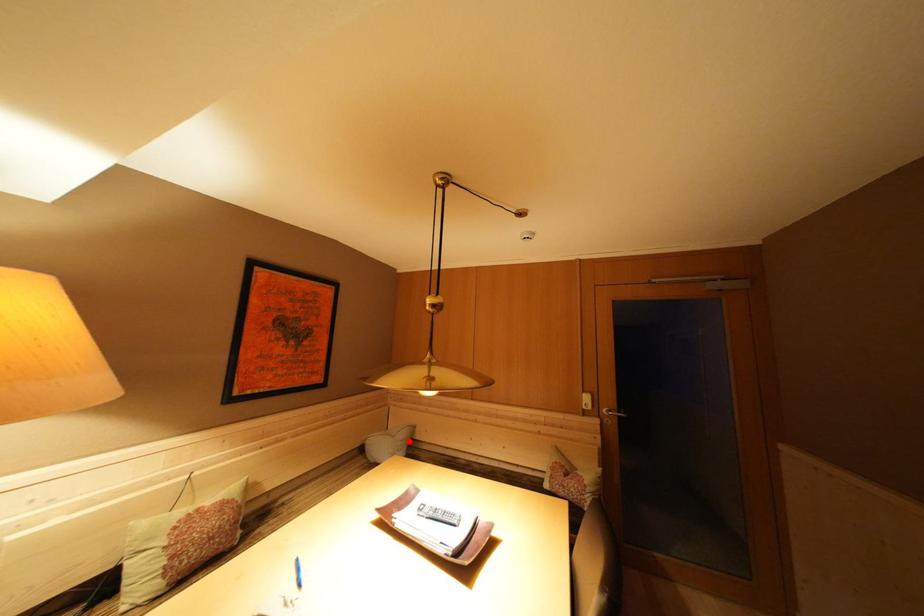
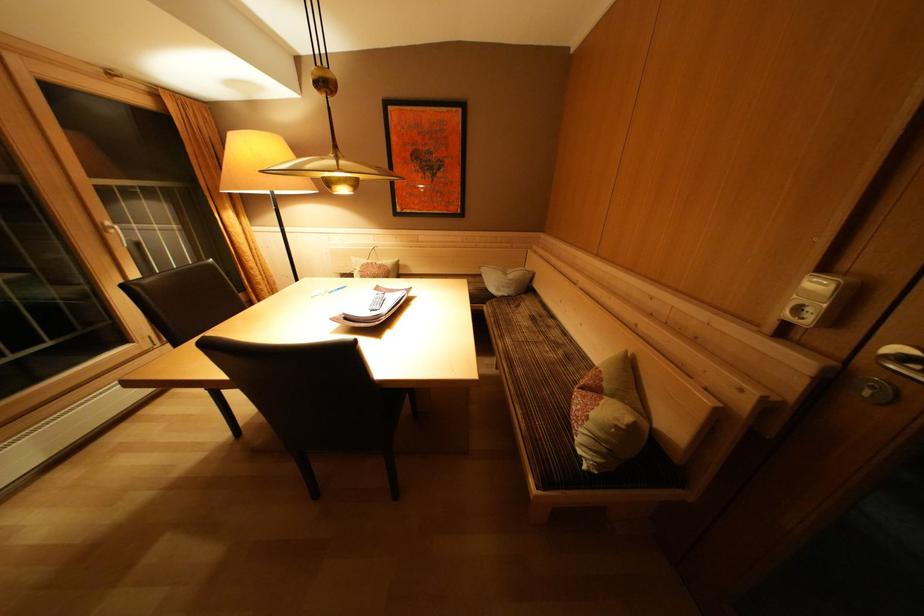
Question: I am providing you with two images of the same scene from different viewpoints. A red point is shown in image1. For the corresponding object point in image2, is it positioned nearer or farther from the camera?

Choices:
 (A) Nearer
 (B) Farther

Answer: (A)